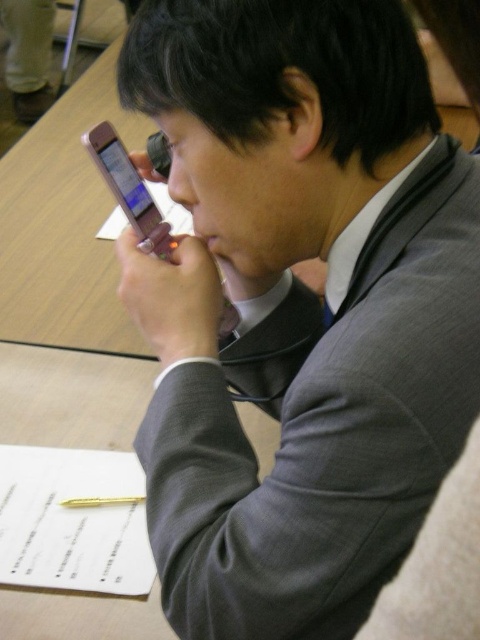
Question: Is the position of pink glossy smartphone at center more distant than that of gold metallic pen at lower center?

Choices:
 (A) no
 (B) yes

Answer: (A)

Question: Among these points, which one is farthest from the camera?

Choices:
 (A) (75, 506)
 (B) (128, 177)

Answer: (A)

Question: Which object appears farthest from the camera in this image?

Choices:
 (A) pink glossy smartphone at center
 (B) gold metallic pen at lower center

Answer: (B)

Question: Which point is farther to the camera?

Choices:
 (A) pink glossy smartphone at center
 (B) gold metallic pen at lower center

Answer: (B)

Question: Can you confirm if pink glossy smartphone at center is positioned to the left of gold metallic pen at lower center?

Choices:
 (A) yes
 (B) no

Answer: (B)

Question: Observing the image, what is the correct spatial positioning of pink glossy smartphone at center in reference to gold metallic pen at lower center?

Choices:
 (A) left
 (B) right

Answer: (B)